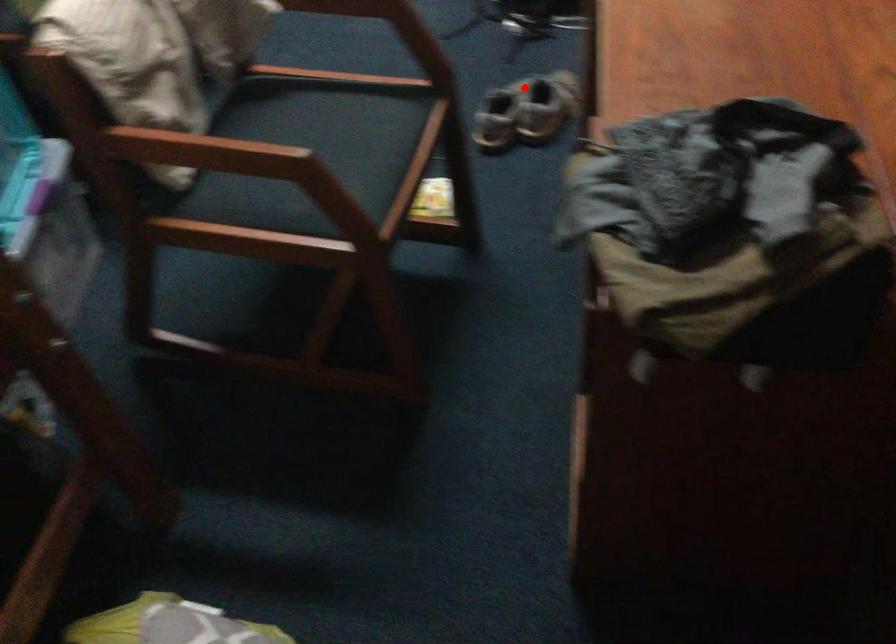
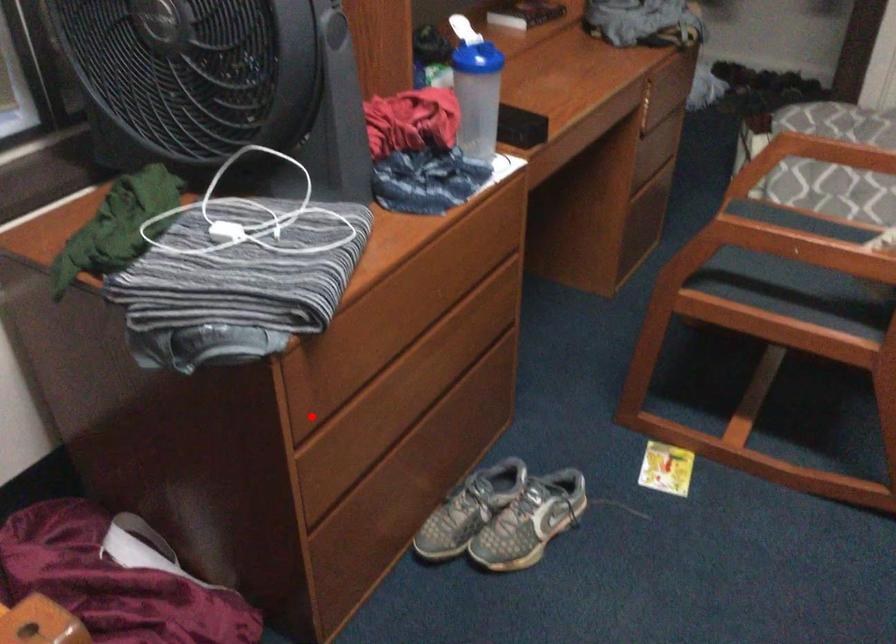
I am providing you with two images of the same scene from different viewpoints. A red point is marked on the first image and another point is marked on the second image. Does the point marked in image1 correspond to the same location as the one in image2?

No